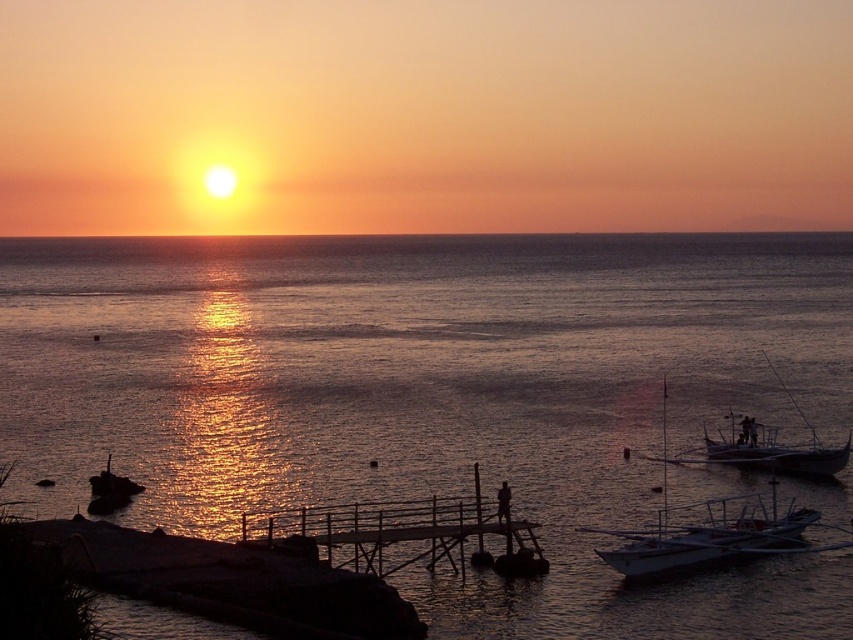
You are an observer on the wooden pier and you see both the white matte boat at lower right and the white glossy boat at lower right. Which boat is bigger?

The white matte boat at lower right is larger in size than the white glossy boat at lower right.

You are standing on the wooden pier and want to reach the white glossy boat at lower right. Based on the scene, is the boat located under or above the glistening water at center?

The white glossy boat at lower right is positioned under the glistening water at center, so the boat is located under the water.

You are standing on the wooden dock at center and want to reach the white matte boat at lower right. Which direction should you move to get there?

You should move to the right because the white matte boat at lower right is located to the right of the wooden dock at center.